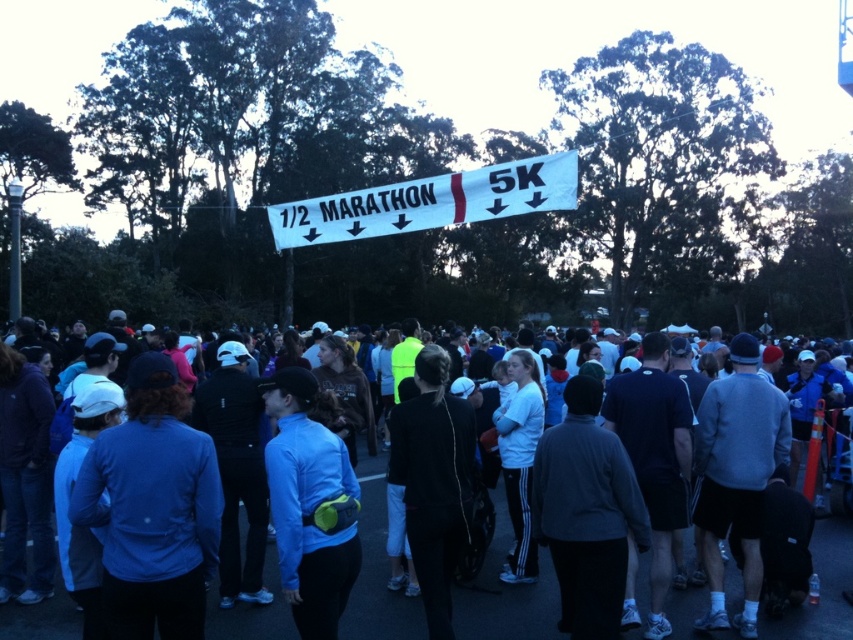
Question: Can you confirm if dark blue fleece at center is wider than white fabric banner at center?

Choices:
 (A) yes
 (B) no

Answer: (A)

Question: Can you confirm if dark blue fleece at center is smaller than white fabric banner at center?

Choices:
 (A) no
 (B) yes

Answer: (A)

Question: Which of the following is the farthest from the observer?

Choices:
 (A) white fabric banner at center
 (B) dark blue fleece at center

Answer: (A)

Question: Among these points, which one is nearest to the camera?

Choices:
 (A) (3, 620)
 (B) (442, 193)

Answer: (A)

Question: Does dark blue fleece at center have a smaller size compared to white fabric banner at center?

Choices:
 (A) yes
 (B) no

Answer: (B)